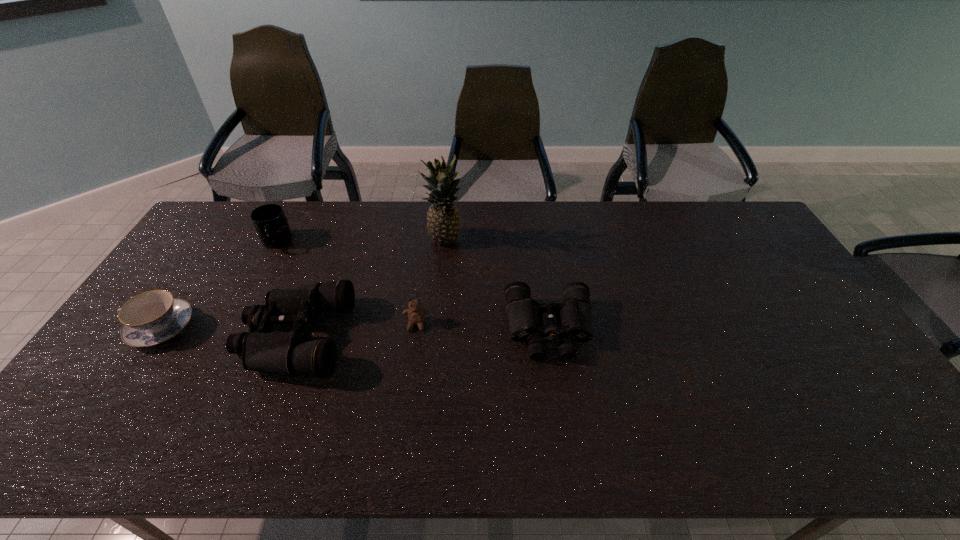
At what (x,y) coordinates should I click in order to perform the action: click on the taller binoculars. Please return your answer as a coordinate pair (x, y). This screenshot has width=960, height=540. Looking at the image, I should click on (292, 353).

At what (x,y) coordinates should I click in order to perform the action: click on the shorter binoculars. Please return your answer as a coordinate pair (x, y). This screenshot has width=960, height=540. Looking at the image, I should click on (573, 316).

At what (x,y) coordinates should I click in order to perform the action: click on the rightmost object. Please return your answer as a coordinate pair (x, y). Looking at the image, I should click on (573, 316).

Locate an element on the screen. The width and height of the screenshot is (960, 540). mug is located at coordinates (270, 222).

You are a GUI agent. You are given a task and a screenshot of the screen. Output one action in this format:
    pyautogui.click(x=<x>, y=<y>)
    Task: Click on the pineapple
    This screenshot has height=540, width=960.
    Given the screenshot: What is the action you would take?
    pyautogui.click(x=443, y=225)

Identify the location of the leftmost object. This screenshot has height=540, width=960. (152, 317).

Locate an element on the screen. teddy bear is located at coordinates (416, 314).

At what (x,y) coordinates should I click in order to perform the action: click on vacant space located 0.170m through the eyepieces of the left binoculars. Please return your answer as a coordinate pair (x, y). This screenshot has height=540, width=960. Looking at the image, I should click on (180, 338).

Find the location of `vacant area located through the eyepieces of the left binoculars`. vacant area located through the eyepieces of the left binoculars is located at coordinates (144, 338).

Locate an element on the screen. This screenshot has height=540, width=960. vacant space located through the eyepieces of the left binoculars is located at coordinates (212, 338).